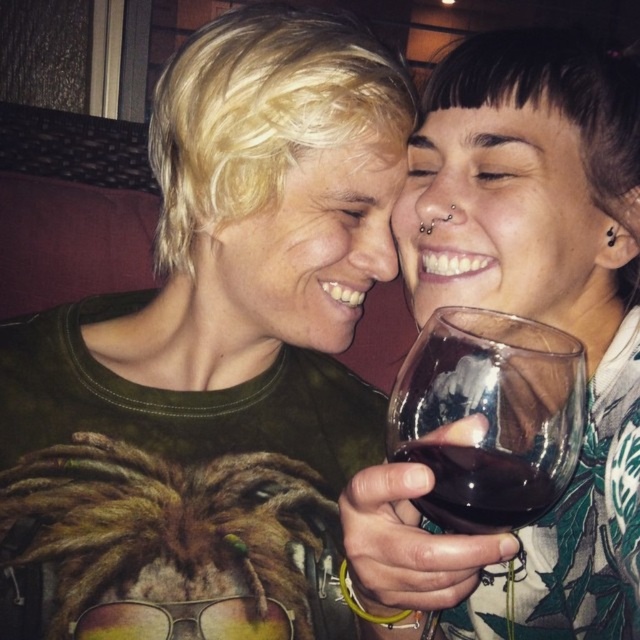
Question: Which of these objects is positioned closest to the transparent glass at center?

Choices:
 (A) dark glass at center
 (B) translucent glass wine at upper right

Answer: (A)

Question: Which object is closer to the camera taking this photo?

Choices:
 (A) transparent glass at center
 (B) translucent glass wine at upper right

Answer: (B)

Question: Does transparent glass at center appear over dark glass at center?

Choices:
 (A) no
 (B) yes

Answer: (B)

Question: Among these points, which one is nearest to the camera?

Choices:
 (A) (534, 387)
 (B) (404, 452)
 (C) (545, 90)

Answer: (A)

Question: Does translucent glass wine at upper right lie behind transparent glass at center?

Choices:
 (A) yes
 (B) no

Answer: (B)

Question: Does translucent glass wine at upper right appear on the right side of transparent glass at center?

Choices:
 (A) no
 (B) yes

Answer: (B)